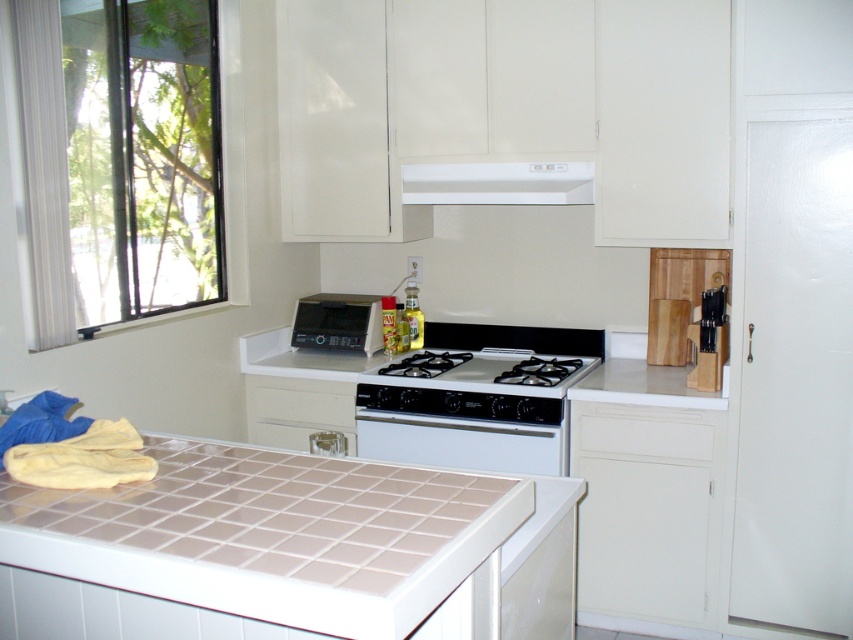
You are standing in the kitchen and want to place a large cutting board on the beige tile countertop at lower center. However, you notice the clear glass window at upper left is directly above it. Will the countertop be obstructed by the window when placing the board?

The beige tile countertop at lower center is in front of the clear glass window at upper left, so placing the large cutting board there will not be obstructed by the window since the window is behind it.